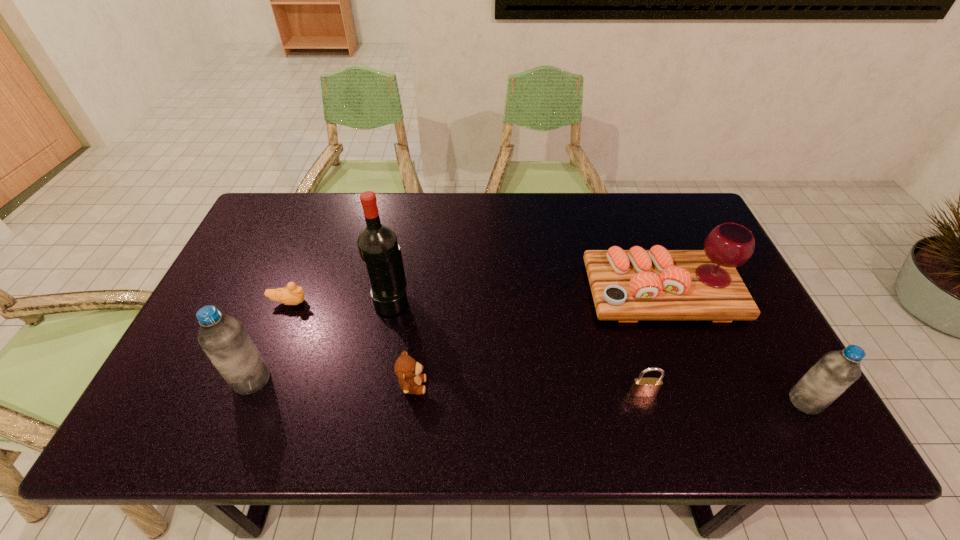
This screenshot has height=540, width=960. I want to click on free spot between the left water bottle and the padlock, so click(x=447, y=386).

Image resolution: width=960 pixels, height=540 pixels. Identify the location of free space between the shortest object and the platter. (476, 297).

The height and width of the screenshot is (540, 960). Find the location of `vacant area between the right water bottle and the teddy bear`. vacant area between the right water bottle and the teddy bear is located at coordinates (609, 394).

Locate an element on the screen. This screenshot has height=540, width=960. free spot between the tallest object and the shorter water bottle is located at coordinates (598, 352).

Where is `empty space that is in between the tallest object and the platter`? The image size is (960, 540). empty space that is in between the tallest object and the platter is located at coordinates (527, 296).

Locate an element on the screen. The height and width of the screenshot is (540, 960). unoccupied area between the padlock and the tallest object is located at coordinates (517, 347).

In order to click on blank region between the right water bottle and the fourth object from left to right in this screenshot , I will do `click(609, 394)`.

Identify the location of free point between the teddy bear and the left water bottle. Image resolution: width=960 pixels, height=540 pixels. (332, 382).

Locate an element on the screen. The image size is (960, 540). unoccupied position between the taller water bottle and the padlock is located at coordinates (447, 386).

At what (x,y) coordinates should I click in order to perform the action: click on free space between the padlock and the sixth shortest object. Please return your answer as a coordinate pair (x, y). Image resolution: width=960 pixels, height=540 pixels. Looking at the image, I should click on (447, 386).